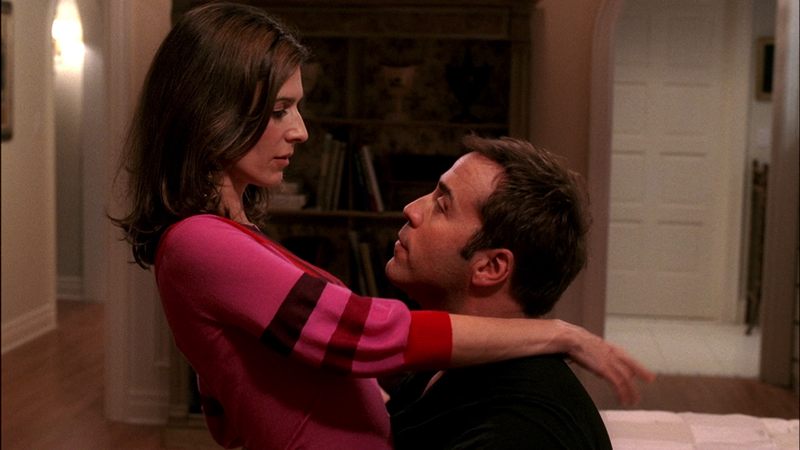
Identify the location of walls. (22, 228), (557, 90), (762, 120).